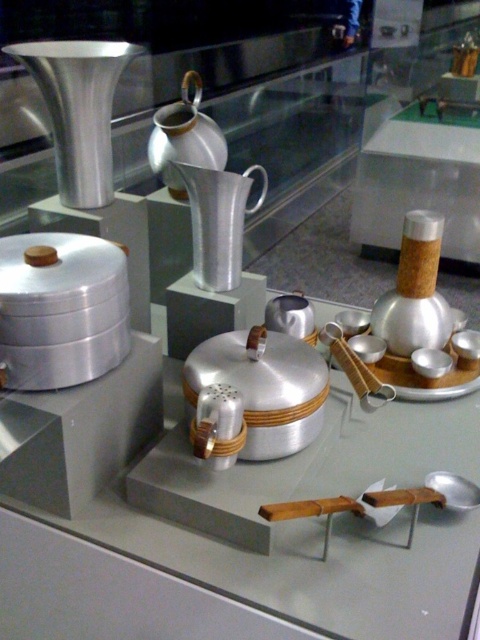
Question: Which point is farther from the camera taking this photo?

Choices:
 (A) (232, 230)
 (B) (186, 108)

Answer: (B)

Question: Which point appears farthest from the camera in this image?

Choices:
 (A) (244, 184)
 (B) (168, 113)

Answer: (B)

Question: Is silver metallic pitcher at center positioned before polished silver teapot at center?

Choices:
 (A) no
 (B) yes

Answer: (B)

Question: Is silver metallic pitcher at center smaller than polished silver teapot at center?

Choices:
 (A) no
 (B) yes

Answer: (A)

Question: Which of the following is the closest to the observer?

Choices:
 (A) (191, 221)
 (B) (210, 131)

Answer: (B)

Question: Can you confirm if silver metallic pitcher at center is wider than polished silver teapot at center?

Choices:
 (A) yes
 (B) no

Answer: (A)